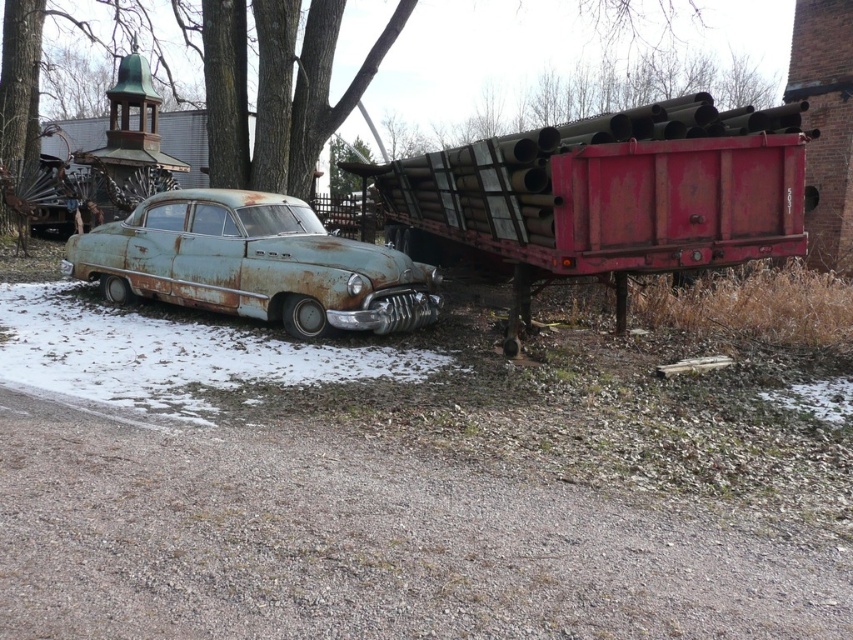
Is rusty metal trailer truck at right closer to camera compared to rusty metal car at center?

Yes, rusty metal trailer truck at right is closer to the viewer.

Is point (427, 160) in front of point (289, 196)?

Yes, point (427, 160) is in front of point (289, 196).

Who is more distant from viewer, (473, 147) or (277, 294)?

Positioned behind is point (277, 294).

You are a GUI agent. You are given a task and a screenshot of the screen. Output one action in this format:
    pyautogui.click(x=<x>, y=<y>)
    Task: Click on the rusty metal trailer truck at right
    
    Given the screenshot: What is the action you would take?
    pyautogui.click(x=605, y=196)